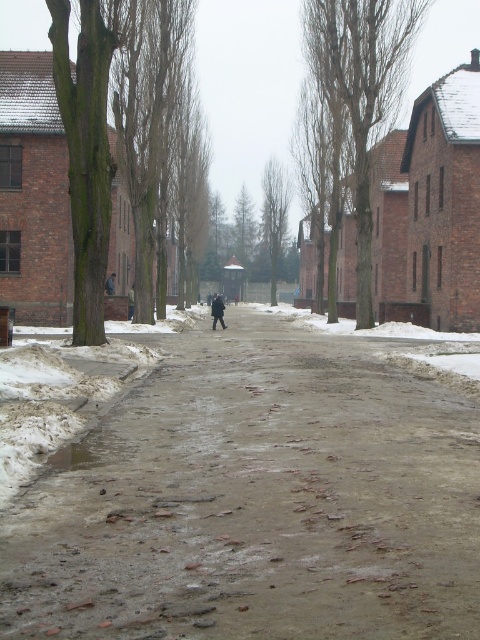
Consider the image. You are standing at the point labeled point (156, 497) and want to walk to point (215, 300). Given that both points are on the snow covered street, which direction should you face to move towards your destination?

You should face away from the camera because point (215, 300) is farther from the camera than point (156, 497).

You are standing on the dull concrete pavement at center and want to move to the dark gray wool coat at center. In which direction should you move?

The dull concrete pavement at center is on the right side of the dark gray wool coat at center, so you should move to the left to reach it.